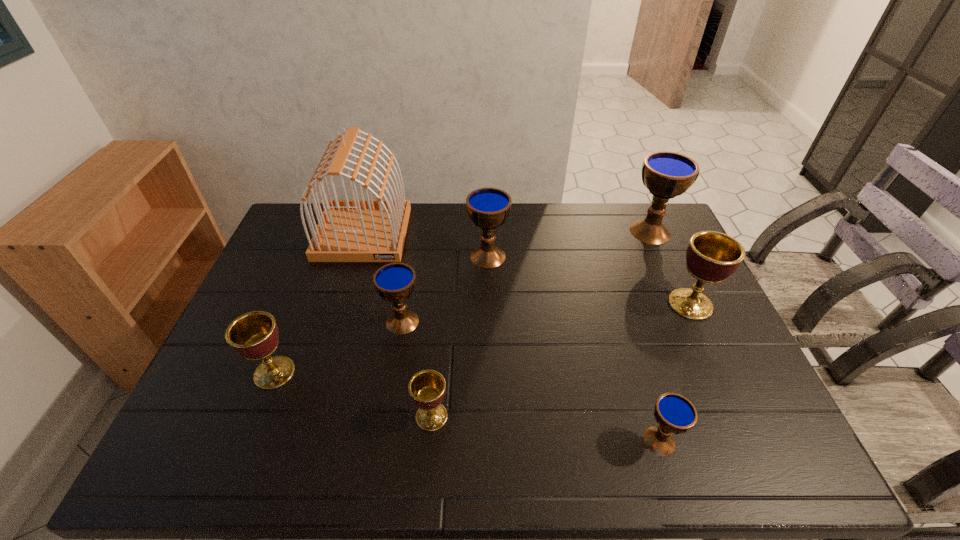
The width and height of the screenshot is (960, 540). In order to click on vacant space that's between the tallest object and the fifth chalice from left to right in this screenshot , I will do `click(512, 337)`.

Locate an element on the screen. This screenshot has height=540, width=960. blank region between the second nearest golden chalice and the seventh shortest object is located at coordinates (462, 302).

This screenshot has height=540, width=960. Find the location of `vacant space that's between the leftmost chalice and the leftmost blue chalice`. vacant space that's between the leftmost chalice and the leftmost blue chalice is located at coordinates (339, 347).

Identify the location of blank region between the rightmost golden chalice and the third nearest chalice. This screenshot has width=960, height=540. (483, 338).

At what (x,y) coordinates should I click in order to perform the action: click on free space between the nearest blue chalice and the biggest golden chalice. Please return your answer as a coordinate pair (x, y). Image resolution: width=960 pixels, height=540 pixels. Looking at the image, I should click on (675, 372).

Choose which object is the sixth nearest neighbor to the birdcage. Please provide its 2D coordinates. Your answer should be formatted as a tuple, i.e. [(x, y)], where the tuple contains the x and y coordinates of a point satisfying the conditions above.

[(711, 257)]

Identify the location of the seventh closest object to the second tallest object. This screenshot has width=960, height=540. (254, 335).

Image resolution: width=960 pixels, height=540 pixels. I want to click on the third closest chalice to the third farthest blue chalice, so click(254, 335).

Identify which chalice is the fourth closest to the second golden chalice from left to right. Please provide its 2D coordinates. Your answer should be formatted as a tuple, i.e. [(x, y)], where the tuple contains the x and y coordinates of a point satisfying the conditions above.

[(488, 208)]

This screenshot has height=540, width=960. I want to click on the third closest blue chalice relative to the third chalice from left to right, so pos(488,208).